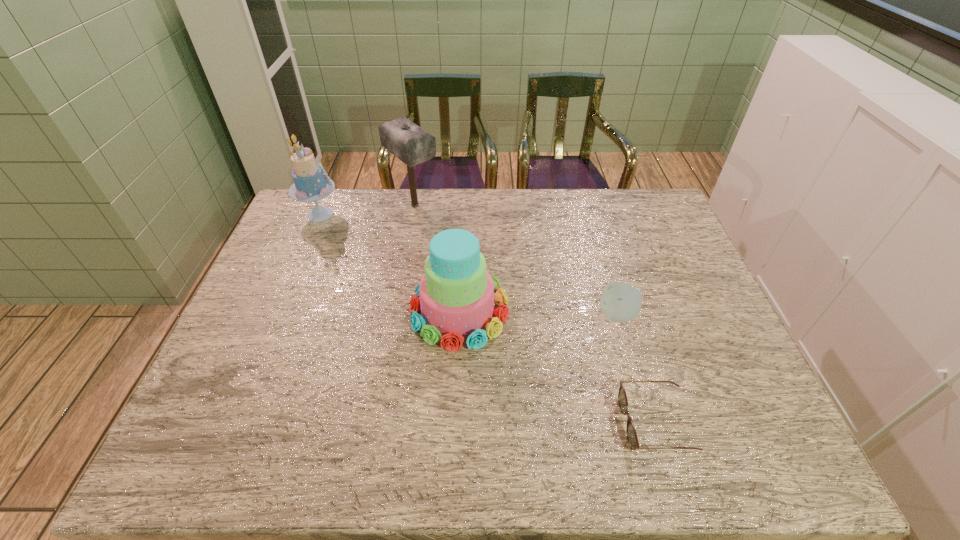
Locate an element on the screen. The image size is (960, 540). free space at the far edge of the desktop is located at coordinates (362, 214).

In the image, there is a desktop. Where is `free space at the near edge`? free space at the near edge is located at coordinates (488, 440).

This screenshot has width=960, height=540. In the image, there is a desktop. In order to click on blank space at the left edge in this screenshot , I will do `click(280, 304)`.

You are a GUI agent. You are given a task and a screenshot of the screen. Output one action in this format:
    pyautogui.click(x=<x>, y=<y>)
    Task: Click on the vacant space at the right edge
    The image size is (960, 540).
    Given the screenshot: What is the action you would take?
    pyautogui.click(x=718, y=370)

The image size is (960, 540). In the image, there is a desktop. What are the coordinates of `free space at the near left corner` in the screenshot? It's located at (186, 449).

Identify the location of vacant region at the far right corner of the desktop. (641, 220).

Identify the location of free spot at the near right corner of the desktop. (722, 446).

In order to click on free space between the mallet and the fourth tallest object in this screenshot , I will do `click(516, 260)`.

The image size is (960, 540). What are the coordinates of `free space between the right cake and the leftmost object` in the screenshot? It's located at (390, 262).

Locate an element on the screen. Image resolution: width=960 pixels, height=540 pixels. empty location between the fourth tallest object and the nearest object is located at coordinates (636, 369).